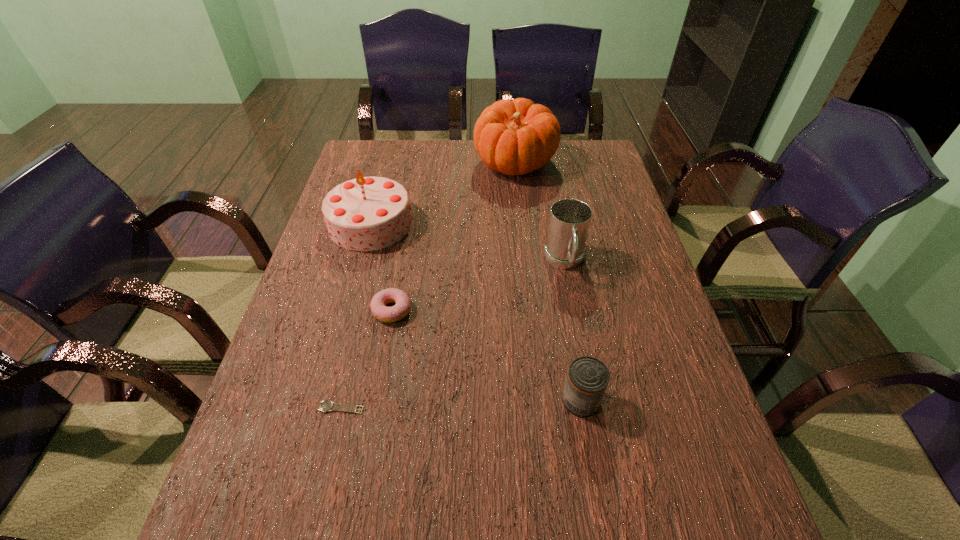
The image size is (960, 540). In order to click on object that is the fourth closest to the fourth tallest object in this screenshot , I will do `click(367, 213)`.

The height and width of the screenshot is (540, 960). In order to click on free space in the image that satisfies the following two spatial constraints: 1. on the back side of the pumpkin; 2. on the left side of the birthday cake in this screenshot , I will do click(387, 164).